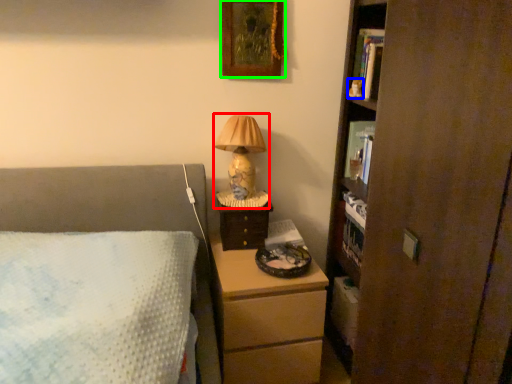
Question: Based on their relative distances, which object is farther from table lamp (highlighted by a red box)? Choose from toy (highlighted by a blue box) and picture frame (highlighted by a green box).

Choices:
 (A) toy
 (B) picture frame

Answer: (A)